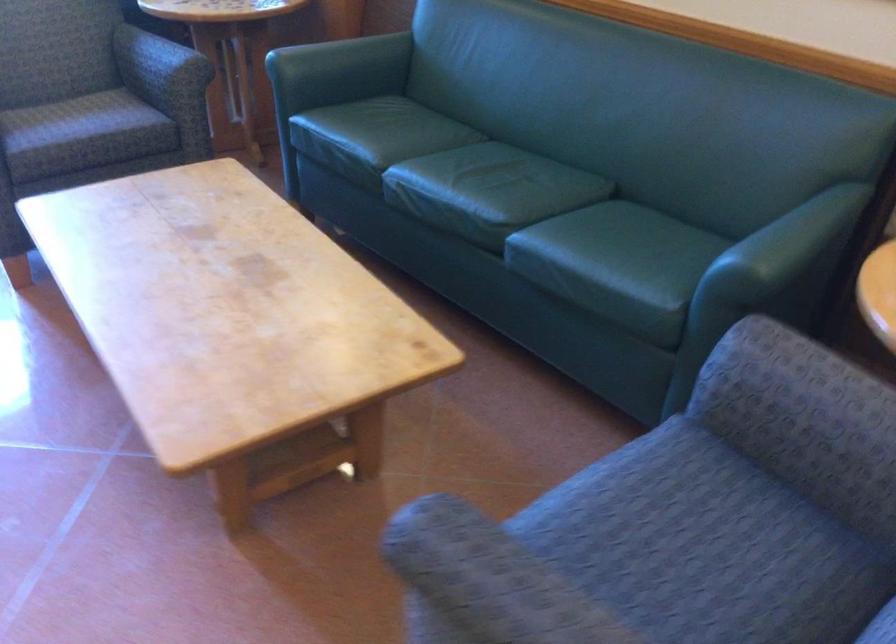
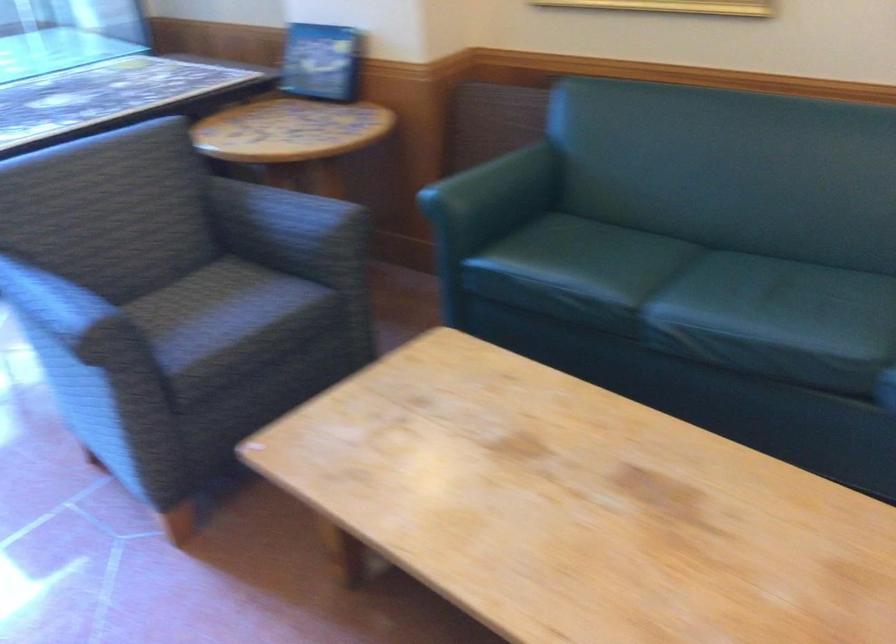
Where in the second image is the point corresponding to (72,116) from the first image?

(224, 317)